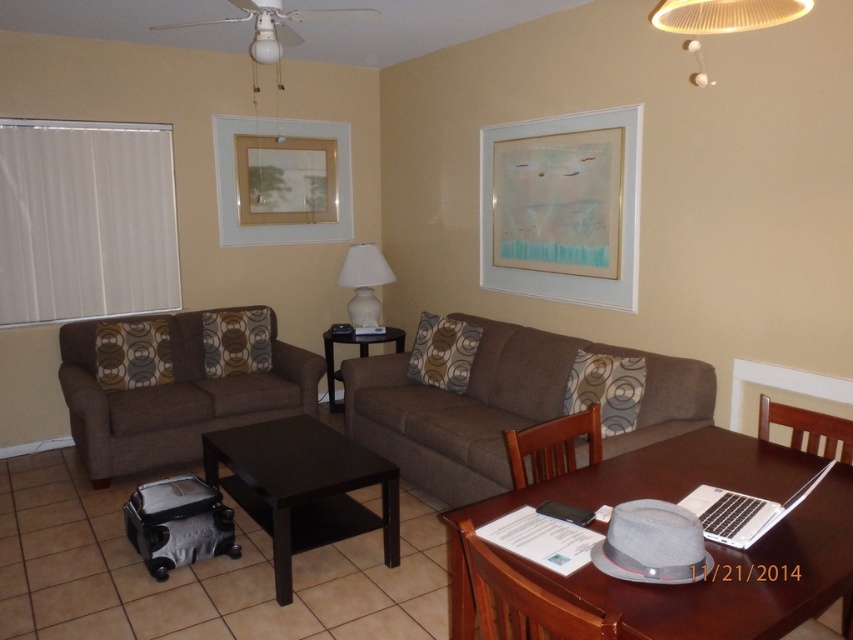
You are trying to decide whether to place a new rectangular side table between the silver metallic laptop at lower right and the brown fabric armchair at right. The side table is 1.2 meters wide. Can the side table fit between them?

The silver metallic laptop at lower right is wider than the brown fabric armchair at right. However, the exact dimensions of the space between them are not provided, so it is uncertain if the 1.2 meter wide side table can fit. More information about the distance between the two objects is needed to determine this.

You are a guest entering the living room and want to sit in the brown fabric armchair at right. Before sitting, you notice the silver metallic laptop at lower right. Where is the laptop located relative to the chair?

The silver metallic laptop at lower right is positioned under the brown fabric armchair at right, so it is directly beneath the chair.